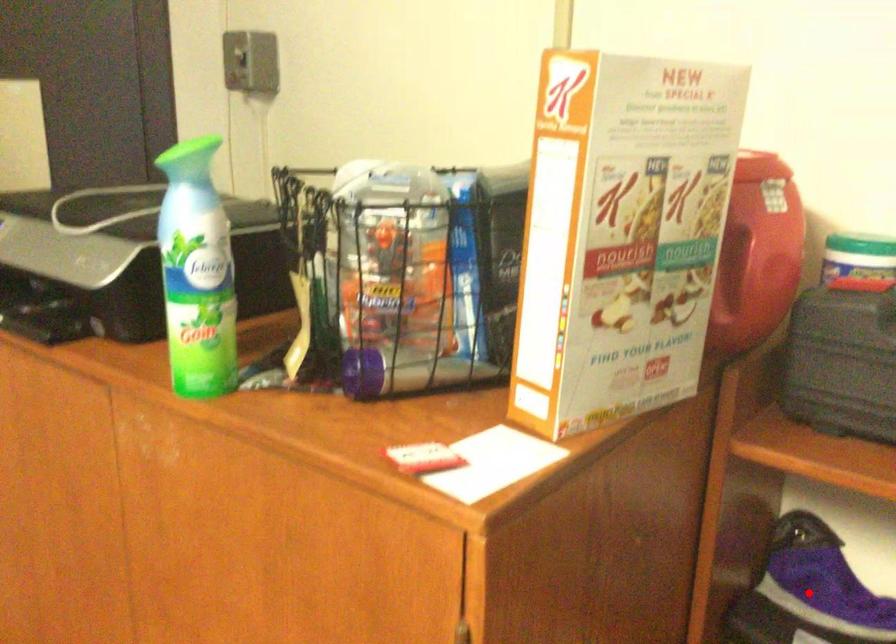
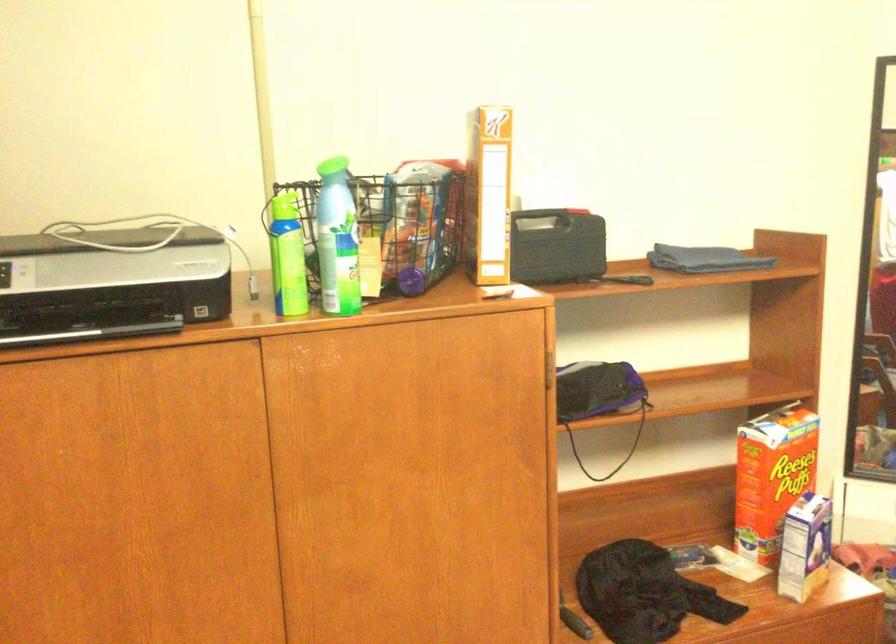
Question: I am providing you with two images of the same scene from different viewpoints. A red point is marked on the first image. At the location where the point appears in image 1, is it still visible in image 2?

Choices:
 (A) Yes
 (B) No

Answer: (B)